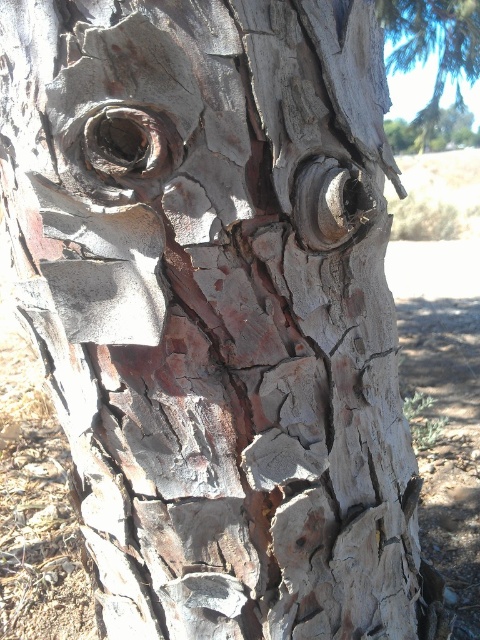
You are an artist trying to sketch the tree trunk face. The point at coordinates (432, 45) is part of the tree trunk. Where exactly on the tree trunk face would this point be located?

The point at coordinates (432, 45) corresponds to the cracked bark tree trunk at upper right.